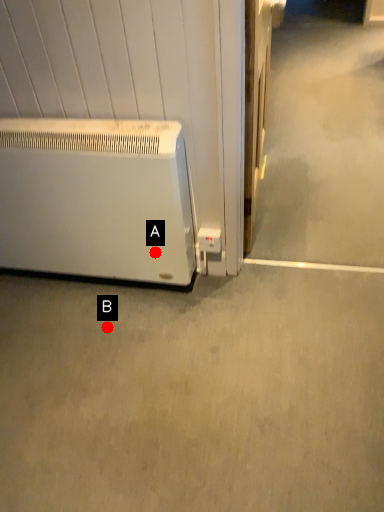
Question: Two points are circled on the image, labeled by A and B beside each circle. Which point is closer to the camera?

Choices:
 (A) A is closer
 (B) B is closer

Answer: (A)